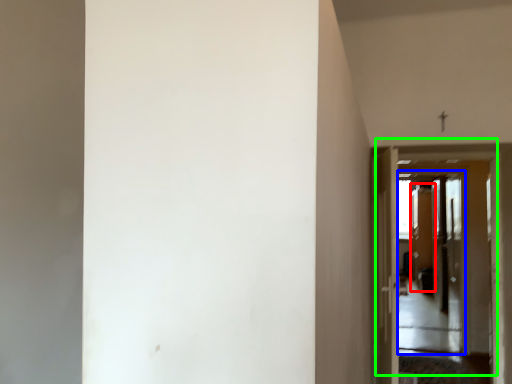
Question: Considering the real-world distances, which object is farthest from screen door (highlighted by a red box)? screen door (highlighted by a blue box) or door (highlighted by a green box)?

Choices:
 (A) screen door
 (B) door

Answer: (B)